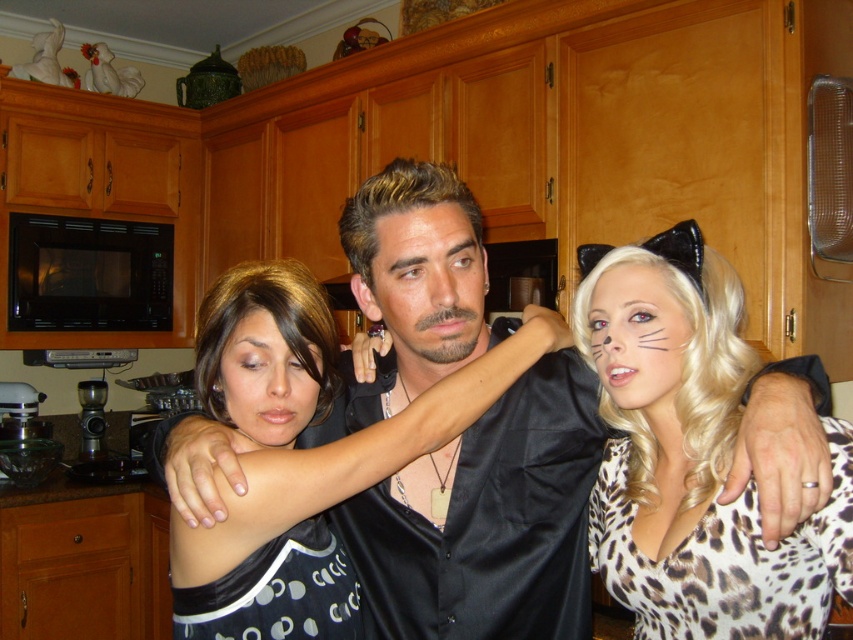
Question: Does black satin shirt at center have a greater width compared to black matte microwave at left?

Choices:
 (A) yes
 (B) no

Answer: (A)

Question: Which is farther from the satin black dress at center?

Choices:
 (A) matte black hair at center
 (B) leopard print fabric at center
 (C) smooth skin face at center
 (D) black matte microwave at left

Answer: (D)

Question: Which point appears farthest from the camera in this image?

Choices:
 (A) (474, 256)
 (B) (550, 525)

Answer: (B)

Question: Which object appears farthest from the camera in this image?

Choices:
 (A) satin black dress at center
 (B) leopard print face at right
 (C) smooth skin face at center
 (D) leopard print fabric at center

Answer: (B)

Question: In this image, where is leopard print fabric at center located relative to matte black hair at center?

Choices:
 (A) left
 (B) right

Answer: (B)

Question: Is leopard print face at right below matte black hair at center?

Choices:
 (A) no
 (B) yes

Answer: (A)